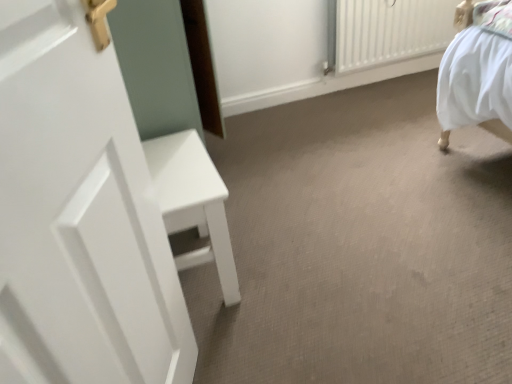
Question: Is white textured radiator at upper right at the back of white matte door at left?

Choices:
 (A) yes
 (B) no

Answer: (B)

Question: From the image's perspective, is white matte door at left on top of white textured radiator at upper right?

Choices:
 (A) no
 (B) yes

Answer: (A)

Question: From the image's perspective, does white matte door at left appear lower than white textured radiator at upper right?

Choices:
 (A) yes
 (B) no

Answer: (A)

Question: Is white matte door at left not near white textured radiator at upper right?

Choices:
 (A) yes
 (B) no

Answer: (A)

Question: Is the depth of white matte door at left greater than that of white textured radiator at upper right?

Choices:
 (A) yes
 (B) no

Answer: (B)

Question: Is white matte door at left to the left of white textured radiator at upper right from the viewer's perspective?

Choices:
 (A) yes
 (B) no

Answer: (A)

Question: Can you confirm if white textured radiator at upper right is thinner than white matte door at left?

Choices:
 (A) no
 (B) yes

Answer: (A)

Question: Can you see white textured radiator at upper right touching white matte door at left?

Choices:
 (A) yes
 (B) no

Answer: (B)

Question: Is white textured radiator at upper right outside of white matte door at left?

Choices:
 (A) yes
 (B) no

Answer: (A)

Question: Can you confirm if white textured radiator at upper right is wider than white matte door at left?

Choices:
 (A) no
 (B) yes

Answer: (B)

Question: Is white textured radiator at upper right at the right side of white matte door at left?

Choices:
 (A) no
 (B) yes

Answer: (B)

Question: Is white matte door at left at the back of white textured radiator at upper right?

Choices:
 (A) yes
 (B) no

Answer: (B)

Question: In terms of height, does white matte door at left look taller or shorter compared to white textured radiator at upper right?

Choices:
 (A) short
 (B) tall

Answer: (B)